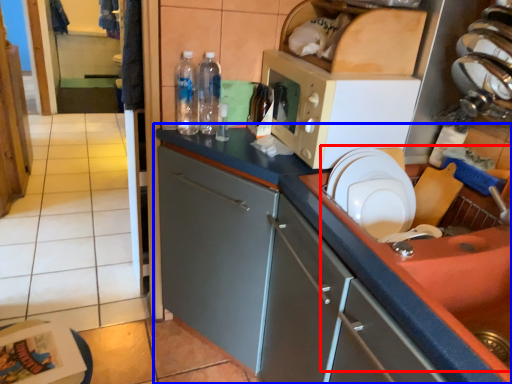
Question: Which object appears farthest to the camera in this image, sink (highlighted by a red box) or cabinetry (highlighted by a blue box)?

Choices:
 (A) sink
 (B) cabinetry

Answer: (B)